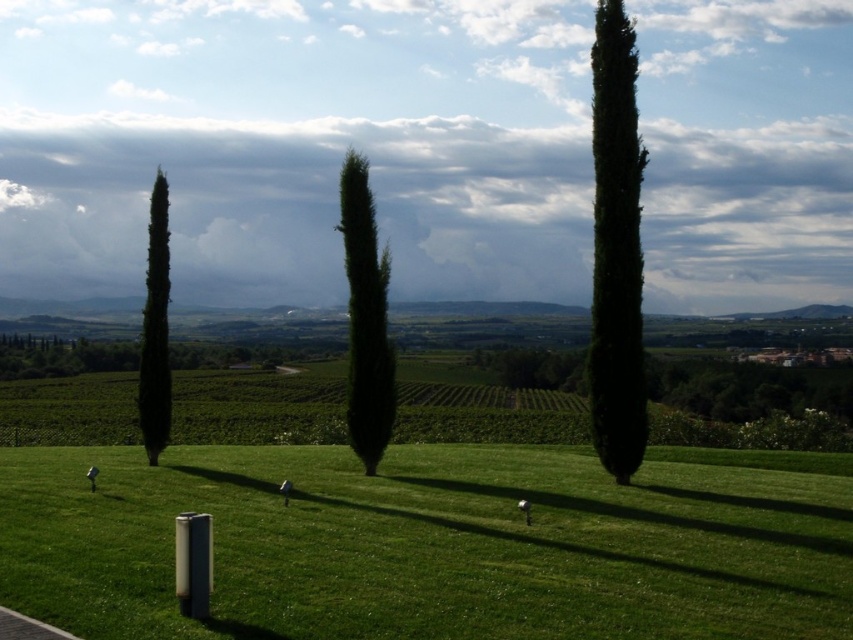
Measure the distance between dark green textured tree at upper right and green matte tree at left.

dark green textured tree at upper right and green matte tree at left are 11.38 meters apart from each other.

Which is above, dark green textured tree at upper right or green matte tree at left?

dark green textured tree at upper right is above.

Who is more forward, (x=624, y=244) or (x=158, y=308)?

Point (x=624, y=244) is in front.

Find the location of a particular element. The width and height of the screenshot is (853, 640). dark green textured tree at upper right is located at coordinates (616, 250).

What do you see at coordinates (427, 545) in the screenshot? Image resolution: width=853 pixels, height=640 pixels. I see `green grassy field at center` at bounding box center [427, 545].

Find the location of a particular element. This screenshot has width=853, height=640. green grassy field at center is located at coordinates click(427, 545).

The width and height of the screenshot is (853, 640). What are the coordinates of `green grassy field at center` in the screenshot? It's located at [x=427, y=545].

Between green grassy field at center and green matte tree at left, which one has more height?

green matte tree at left is taller.

How distant is green grassy field at center from green matte tree at left?

The distance of green grassy field at center from green matte tree at left is 28.34 feet.

Is point (254, 604) positioned before point (148, 276)?

Yes, point (254, 604) is in front of point (148, 276).

Where is `green grassy field at center`? green grassy field at center is located at coordinates (427, 545).